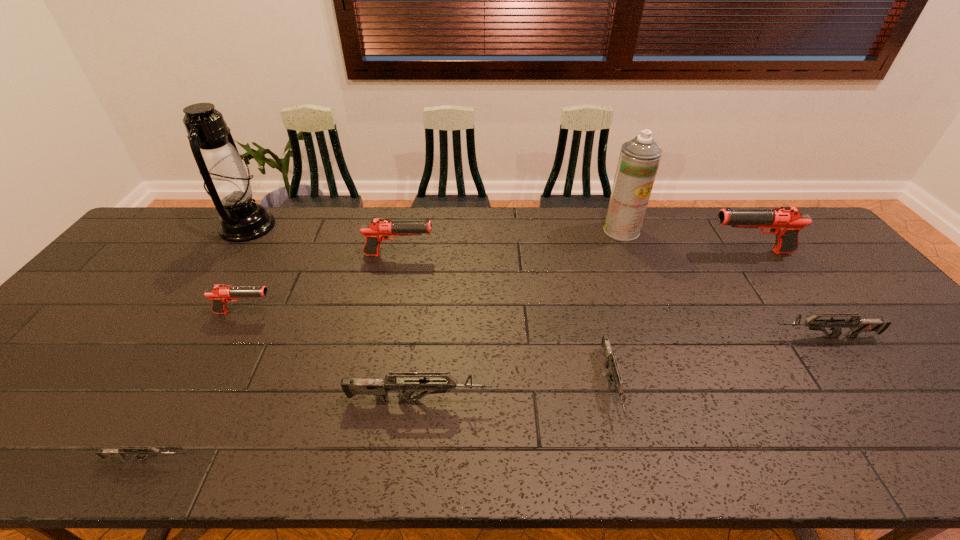
Where is `free spot located 0.320m at the aiming end of the third tallest object`? free spot located 0.320m at the aiming end of the third tallest object is located at coordinates (604, 252).

Identify the location of free space located 0.250m at the aiming end of the sixth shortest object. This screenshot has height=540, width=960. (514, 255).

Locate an element on the screen. The height and width of the screenshot is (540, 960). free spot located 0.390m at the aiming end of the third farthest gun is located at coordinates (420, 313).

Locate an element on the screen. The height and width of the screenshot is (540, 960). vacant space located 0.100m aimed along the barrel of the third grey gun from right to left is located at coordinates (536, 400).

Find the location of `blank space located 0.280m aimed along the barrel of the rightmost grey gun`. blank space located 0.280m aimed along the barrel of the rightmost grey gun is located at coordinates (661, 336).

Where is `vacant position located 0.320m aimed along the barrel of the rightmost grey gun`? The width and height of the screenshot is (960, 540). vacant position located 0.320m aimed along the barrel of the rightmost grey gun is located at coordinates (646, 336).

The width and height of the screenshot is (960, 540). Identify the location of blank area located 0.310m aimed along the barrel of the rightmost grey gun. (650, 336).

The width and height of the screenshot is (960, 540). What are the coordinates of `vacant position located aimed along the barrel of the third biggest grey gun` in the screenshot? It's located at (633, 463).

Identify the location of vacant space positioned 0.180m aimed along the barrel of the shortest gun. The width and height of the screenshot is (960, 540). (276, 459).

Image resolution: width=960 pixels, height=540 pixels. I want to click on oil lamp that is at the far edge, so click(x=228, y=182).